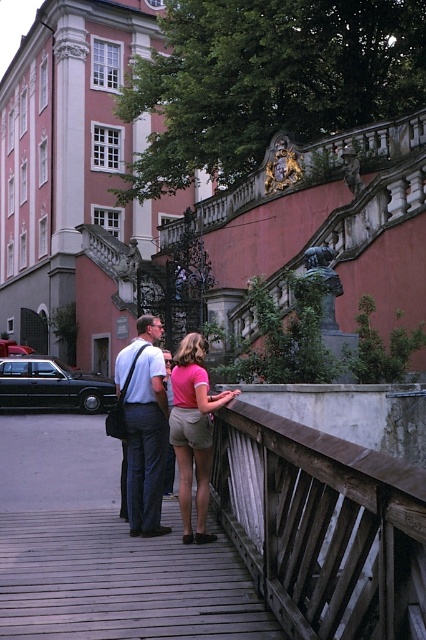
You are a photographer planning to take a group photo of the two people on the bridge. Given that the matte pink shirt at center and the matte white shirt at center are both facing the camera, which person should you position closer to the center to ensure their shirts are clearly visible in the frame?

The matte pink shirt at center should be positioned closer to the center because its width surpasses that of the matte white shirt at center, making it more noticeable and ensuring visibility.

You are a photographer trying to capture both the matte white shirt at center and the pink fabric shirt at center in a single frame. Since you want to ensure both are fully visible, which person should you position closer to the camera to avoid cropping?

The pink fabric shirt at center should be positioned closer to the camera because the matte white shirt at center is taller, so moving the shorter pink fabric shirt at center forward will help ensure both are fully visible in the frame.

You are an architect analyzing the scene. You notice the matte pink building at upper left and the matte pink shirt at center. Which of these two pink items has a greater width?

The matte pink building at upper left has a greater width than the matte pink shirt at center.